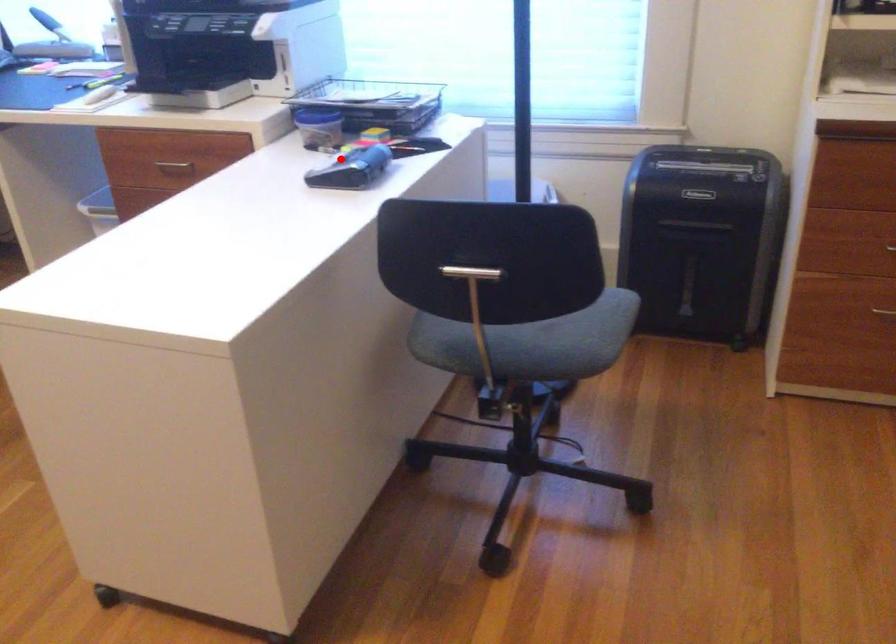
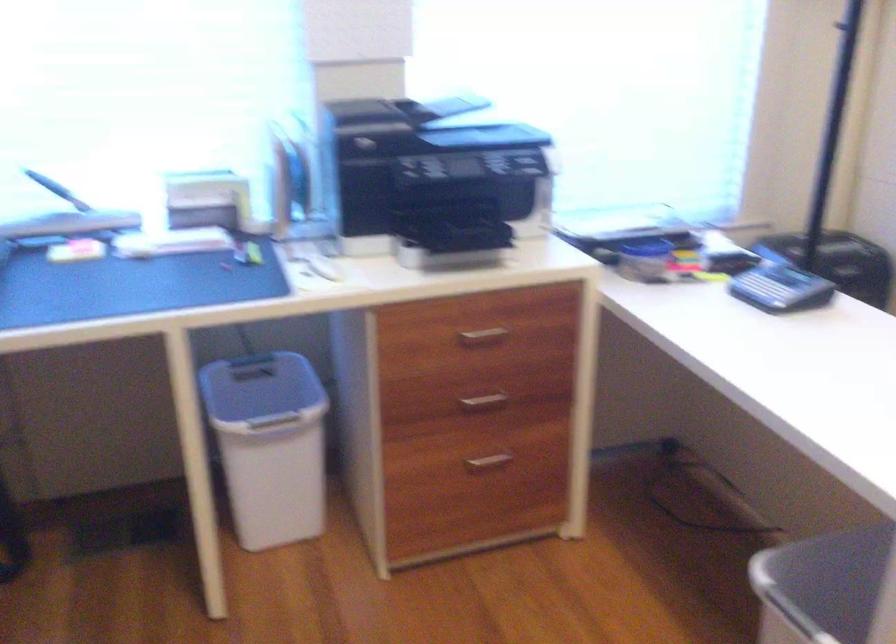
Where in the second image is the point corresponding to the highlighted location from the first image?

(780, 288)